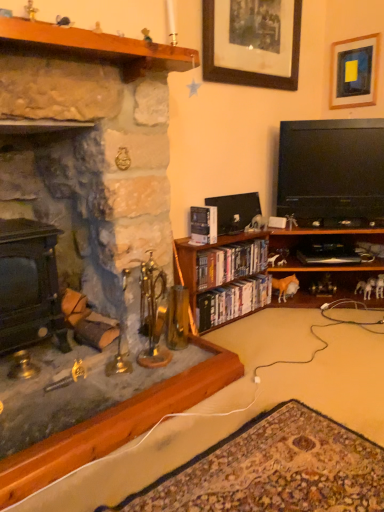
Where is `free region under wooden bookshelf at lower center (from a real-world perspective)`? The width and height of the screenshot is (384, 512). free region under wooden bookshelf at lower center (from a real-world perspective) is located at coordinates (306, 332).